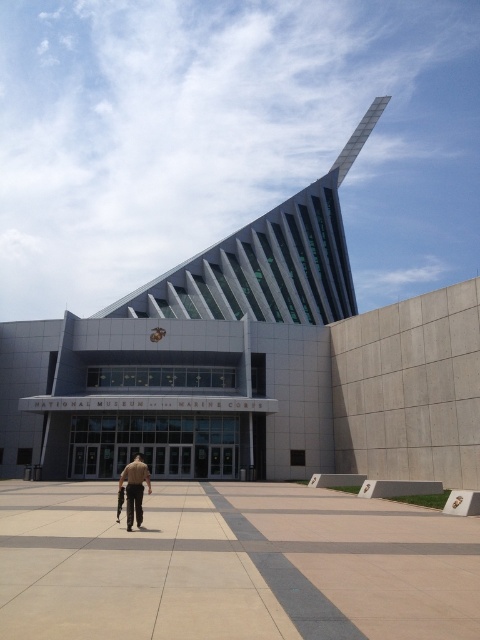
Does beige concrete pavement at center have a lesser width compared to tan uniform at center?

No.

Between point (469, 570) and point (129, 525), which one is positioned behind?

Positioned behind is point (129, 525).

Locate an element on the screen. beige concrete pavement at center is located at coordinates (231, 564).